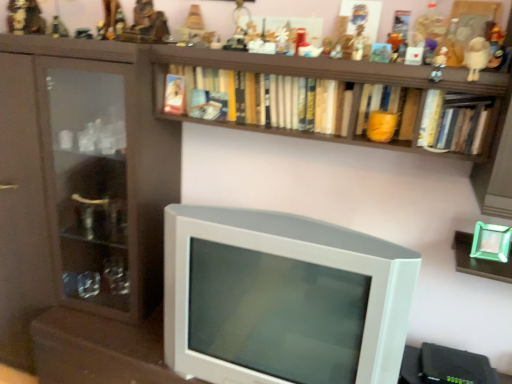
Question: From the image's perspective, is metallic gold figurine at upper left, which is the 11th toy from right to left, located above hardcover book at upper right, the first book from the right?

Choices:
 (A) no
 (B) yes

Answer: (B)

Question: Can you confirm if metallic gold figurine at upper left, acting as the 1th toy starting from the left, is positioned to the left of hardcover book at upper right, acting as the 3th book starting from the left?

Choices:
 (A) yes
 (B) no

Answer: (A)

Question: From a real-world perspective, is metallic gold figurine at upper left, acting as the 1th toy starting from the left, over hardcover book at upper right, the first book from the right?

Choices:
 (A) yes
 (B) no

Answer: (A)

Question: Is hardcover book at upper right, acting as the 3th book starting from the left, at the back of metallic gold figurine at upper left, acting as the 1th toy starting from the left?

Choices:
 (A) no
 (B) yes

Answer: (A)

Question: Is metallic gold figurine at upper left, acting as the 1th toy starting from the left, smaller than hardcover book at upper right, acting as the 3th book starting from the left?

Choices:
 (A) yes
 (B) no

Answer: (B)

Question: In the image, is matte plastic toy at upper center, marked as the 4th toy in a right-to-left arrangement, positioned in front of or behind metallic gold figurine at upper center, the 10th toy when ordered from right to left?

Choices:
 (A) front
 (B) behind

Answer: (A)

Question: Considering the positions of matte plastic toy at upper center, which appears as the eighth toy when viewed from the left, and metallic gold figurine at upper center, the 2th toy positioned from the left, in the image, is matte plastic toy at upper center, which appears as the eighth toy when viewed from the left, taller or shorter than metallic gold figurine at upper center, the 2th toy positioned from the left,?

Choices:
 (A) tall
 (B) short

Answer: (B)

Question: Choose the correct answer: Is matte plastic toy at upper center, marked as the 4th toy in a right-to-left arrangement, inside metallic gold figurine at upper center, the 2th toy positioned from the left, or outside it?

Choices:
 (A) inside
 (B) outside

Answer: (B)

Question: From the image's perspective, is matte plastic toy at upper center, which appears as the eighth toy when viewed from the left, located above or below metallic gold figurine at upper center, the 10th toy when ordered from right to left?

Choices:
 (A) below
 (B) above

Answer: (A)

Question: Is point (493, 54) closer or farther from the camera than point (374, 357)?

Choices:
 (A) farther
 (B) closer

Answer: (B)

Question: Visually, is white plastic figurine at upper right, which appears as the eleventh toy when viewed from the left, positioned to the left or to the right of white plastic television at center?

Choices:
 (A) left
 (B) right

Answer: (B)

Question: Considering the positions of white plastic figurine at upper right, which appears as the eleventh toy when viewed from the left, and white plastic television at center in the image, is white plastic figurine at upper right, which appears as the eleventh toy when viewed from the left, wider or thinner than white plastic television at center?

Choices:
 (A) thin
 (B) wide

Answer: (A)

Question: Based on their sizes in the image, would you say white plastic figurine at upper right, placed as the first toy when sorted from right to left, is bigger or smaller than white plastic television at center?

Choices:
 (A) big
 (B) small

Answer: (B)

Question: Does point (100, 34) appear closer or farther from the camera than point (184, 102)?

Choices:
 (A) farther
 (B) closer

Answer: (A)

Question: Do you think metallic figurine at upper center, placed as the eighth toy when sorted from right to left, is within hardcover books at upper center, the first book when ordered from left to right, or outside of it?

Choices:
 (A) inside
 (B) outside

Answer: (B)